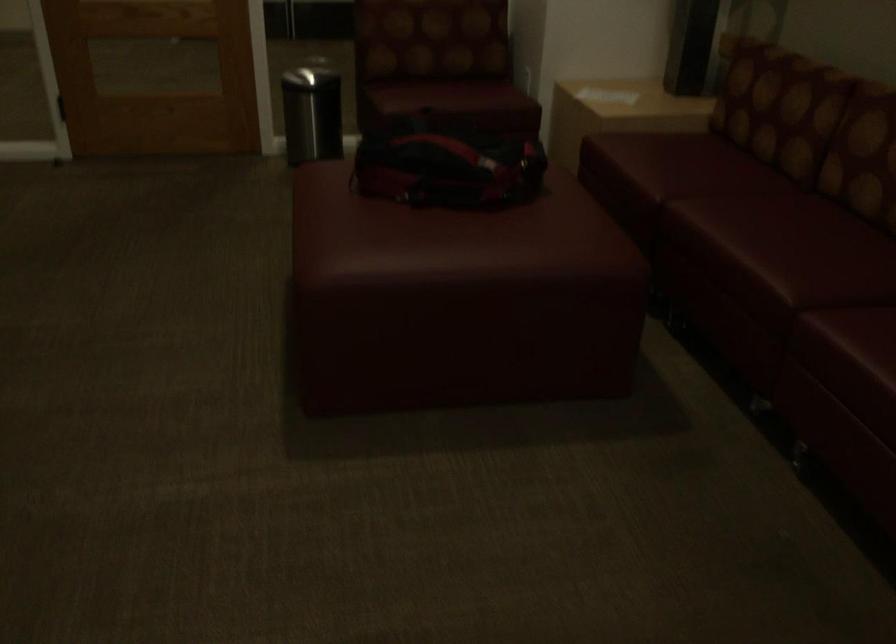
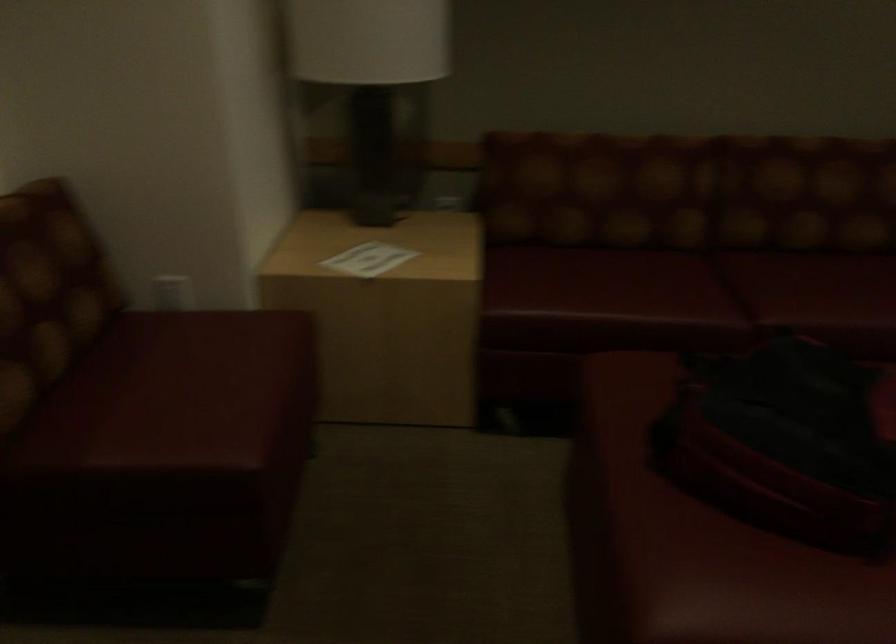
Locate, in the second image, the point that corresponds to point (707, 180) in the first image.

(698, 286)